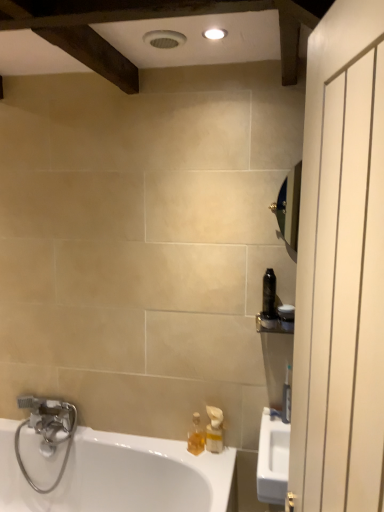
Question: From the image's perspective, relative to black plastic bottle at right, acting as the 1th toiletry starting from the top, is silver metallic faucet at lower left above or below?

Choices:
 (A) above
 (B) below

Answer: (B)

Question: In terms of width, does silver metallic faucet at lower left look wider or thinner when compared to black plastic bottle at right, the third toiletry positioned from the bottom?

Choices:
 (A) thin
 (B) wide

Answer: (B)

Question: Which of these objects is positioned farthest from the silver metallic faucet at lower left?

Choices:
 (A) black plastic toothbrush at right, which ranks as the second toiletry in bottom-to-top order
 (B) white plastic toothbrush at right, the 3th toiletry viewed from the top
 (C) white matte screen door at right
 (D) translucent plastic soap dispenser at lower center, placed as the first soap dispenser when sorted from right to left
 (E) black plastic bottle at right, acting as the 1th toiletry starting from the top

Answer: (C)

Question: Which of these objects is positioned farthest from the white plastic toothbrush at right, the 3th toiletry viewed from the top?

Choices:
 (A) silver metallic faucet at lower left
 (B) black plastic bottle at right, the third toiletry positioned from the bottom
 (C) white glossy sink at right
 (D) white glossy bathtub at lower left
 (E) white matte screen door at right

Answer: (A)